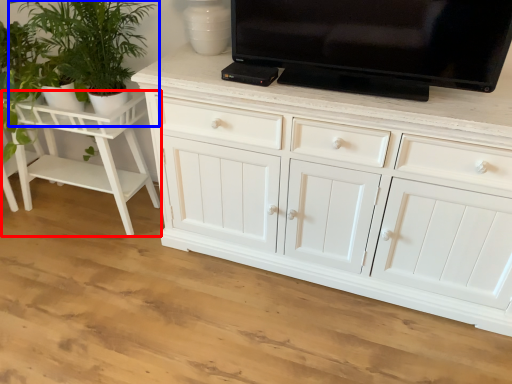
Question: Which object is closer to the camera taking this photo, vanity (highlighted by a red box) or houseplant (highlighted by a blue box)?

Choices:
 (A) vanity
 (B) houseplant

Answer: (B)